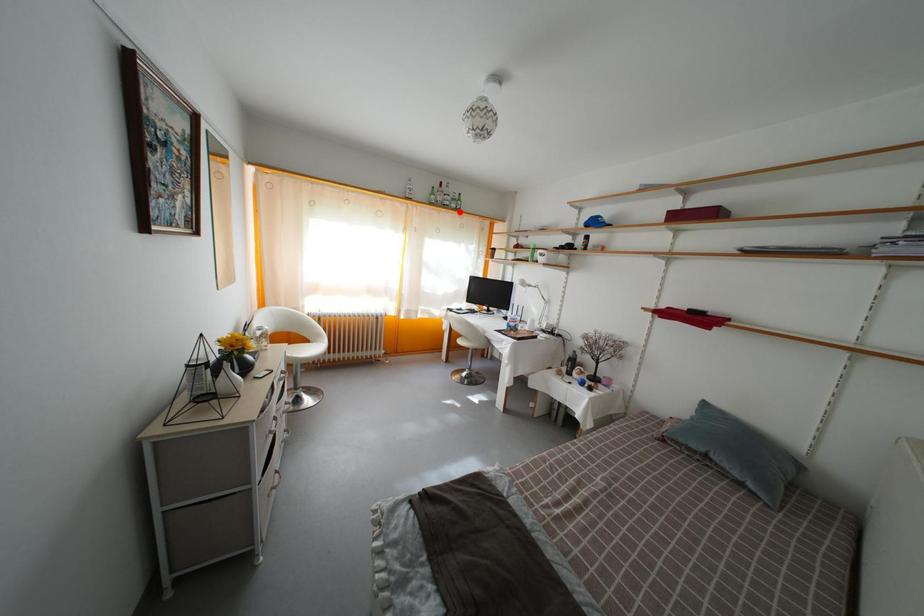
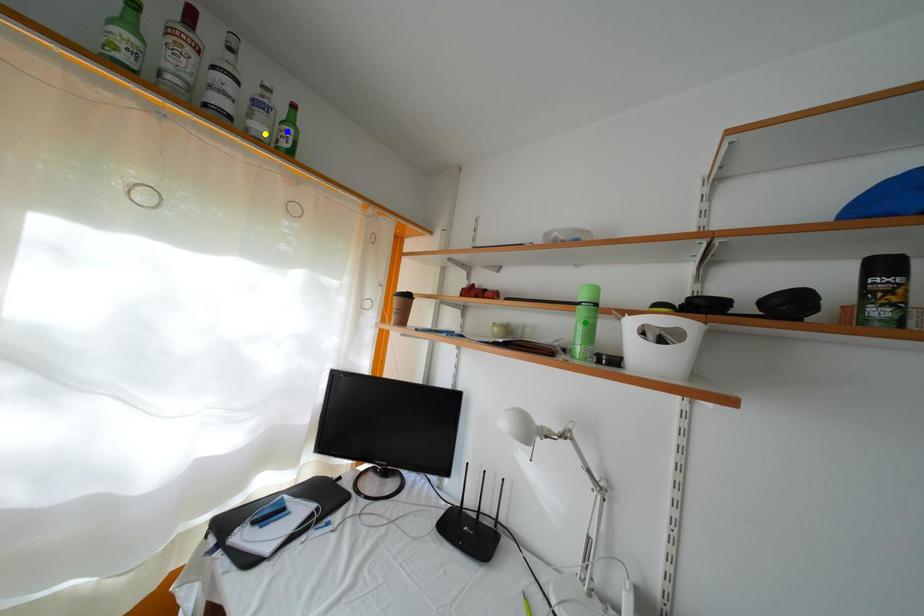
Question: I am providing you with two images of the same scene from different viewpoints. A red point is marked on the first image. You are given multiple points on the second image. Which spot in image 2 lines up with the point in image 1?

Choices:
 (A) blue point
 (B) green point
 (C) yellow point

Answer: (C)